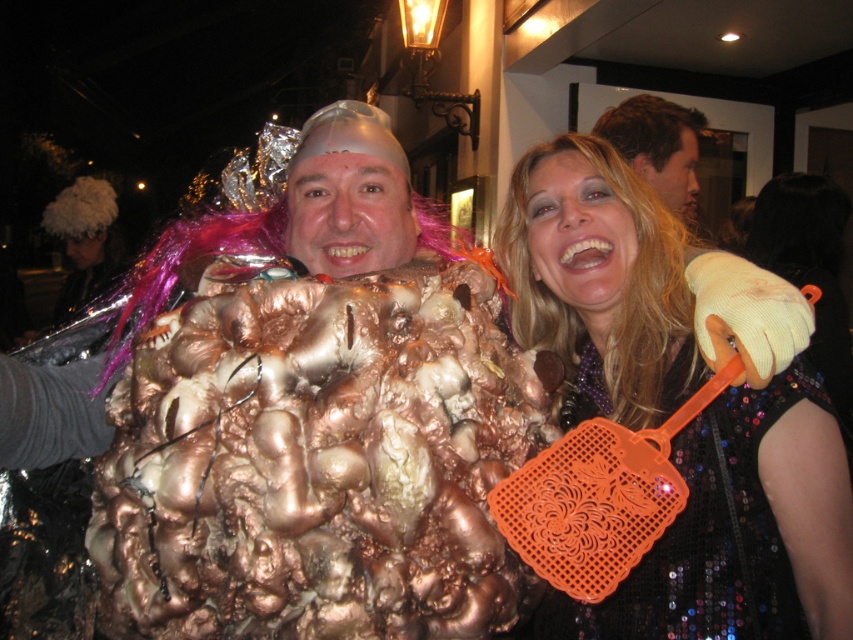
Question: Does orange plastic flyswatter at right have a smaller size compared to blonde synthetic wig at upper right?

Choices:
 (A) no
 (B) yes

Answer: (A)

Question: Does orange plastic flyswatter at right lie behind shiny gold costume at center?

Choices:
 (A) yes
 (B) no

Answer: (B)

Question: Which of these objects is positioned closest to the shiny gold costume at center?

Choices:
 (A) blonde synthetic wig at upper right
 (B) orange plastic flyswatter at right

Answer: (A)

Question: Among these points, which one is farthest from the camera?

Choices:
 (A) (508, 260)
 (B) (653, 118)
 (C) (668, 305)

Answer: (B)

Question: Which point is closer to the camera?

Choices:
 (A) (627, 205)
 (B) (526, 225)

Answer: (A)

Question: Observing the image, what is the correct spatial positioning of orange plastic flyswatter at right in reference to blonde synthetic wig at upper right?

Choices:
 (A) below
 (B) above

Answer: (A)